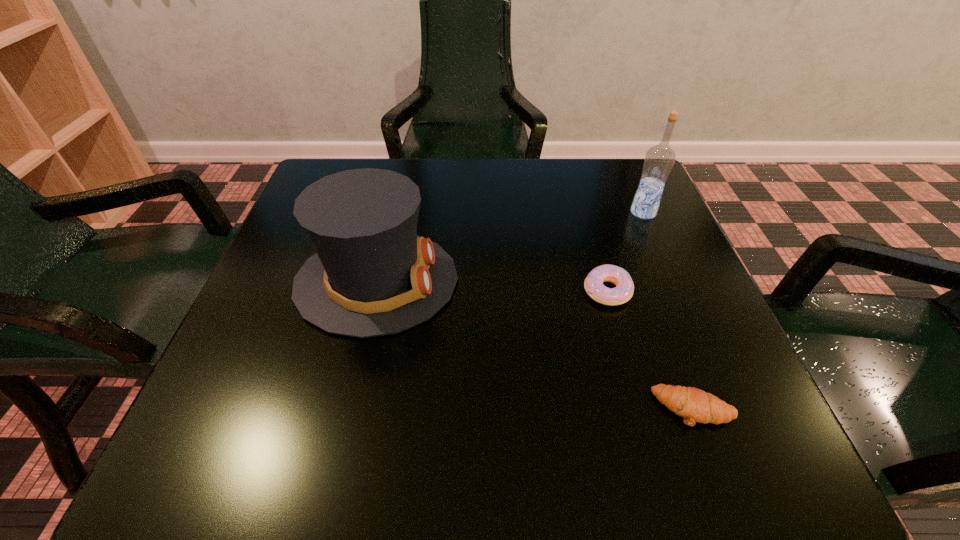
Identify the location of vacant area between the third shortest object and the nearest object. (x=535, y=345).

Find the location of `free space between the third shortest object and the doughnut`. free space between the third shortest object and the doughnut is located at coordinates (492, 286).

The height and width of the screenshot is (540, 960). Identify the location of free spot between the farthest object and the third shortest object. (510, 247).

The image size is (960, 540). What are the coordinates of `object identified as the closest to the doughnut` in the screenshot? It's located at (694, 405).

Select which object appears as the third closest to the tallest object. Please provide its 2D coordinates. Your answer should be formatted as a tuple, i.e. [(x, y)], where the tuple contains the x and y coordinates of a point satisfying the conditions above.

[(694, 405)]

Find the location of `vacant position in the image that satisfies the following two spatial constraints: 1. on the front side of the vodka; 2. with goggles on the front of the leftmost object`. vacant position in the image that satisfies the following two spatial constraints: 1. on the front side of the vodka; 2. with goggles on the front of the leftmost object is located at coordinates (673, 281).

You are a GUI agent. You are given a task and a screenshot of the screen. Output one action in this format:
    pyautogui.click(x=<x>, y=<y>)
    Task: Click on the free space that satisfies the following two spatial constraints: 1. on the back side of the vodka; 2. on the right side of the crescent roll
    This screenshot has height=540, width=960.
    Given the screenshot: What is the action you would take?
    pyautogui.click(x=620, y=212)

Locate an element on the screen. The image size is (960, 540). vacant region that satisfies the following two spatial constraints: 1. with goggles on the front of the third shortest object; 2. on the back side of the crescent roll is located at coordinates (347, 408).

You are a GUI agent. You are given a task and a screenshot of the screen. Output one action in this format:
    pyautogui.click(x=<x>, y=<y>)
    Task: Click on the vacant space that satisfies the following two spatial constraints: 1. on the back side of the doughnut; 2. with goggles on the front of the second tallest object
    Image resolution: width=960 pixels, height=540 pixels.
    Given the screenshot: What is the action you would take?
    [604, 281]

In order to click on free location that satisfies the following two spatial constraints: 1. on the back side of the nearest object; 2. on the right side of the farthest object in this screenshot , I will do `click(620, 212)`.